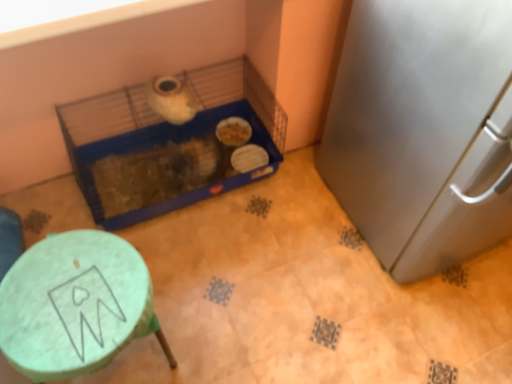
At what (x,y) coordinates should I click in order to perform the action: click on vacant area that lies between satin silver refrigerator at right and dark brown textured bedding at center. Please return your answer as a coordinate pair (x, y). Image resolution: width=512 pixels, height=384 pixels. Looking at the image, I should click on (281, 237).